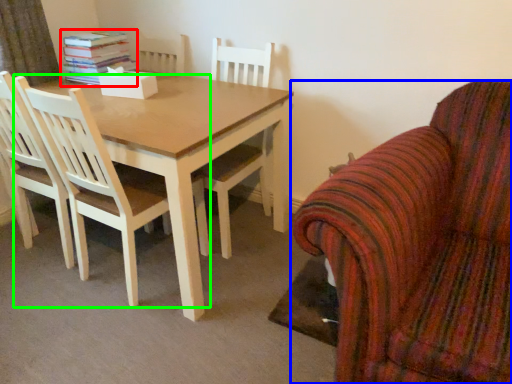
Question: Estimate the real-world distances between objects in this image. Which object is closer to book (highlighted by a red box), chair (highlighted by a blue box) or chair (highlighted by a green box)?

Choices:
 (A) chair
 (B) chair

Answer: (B)